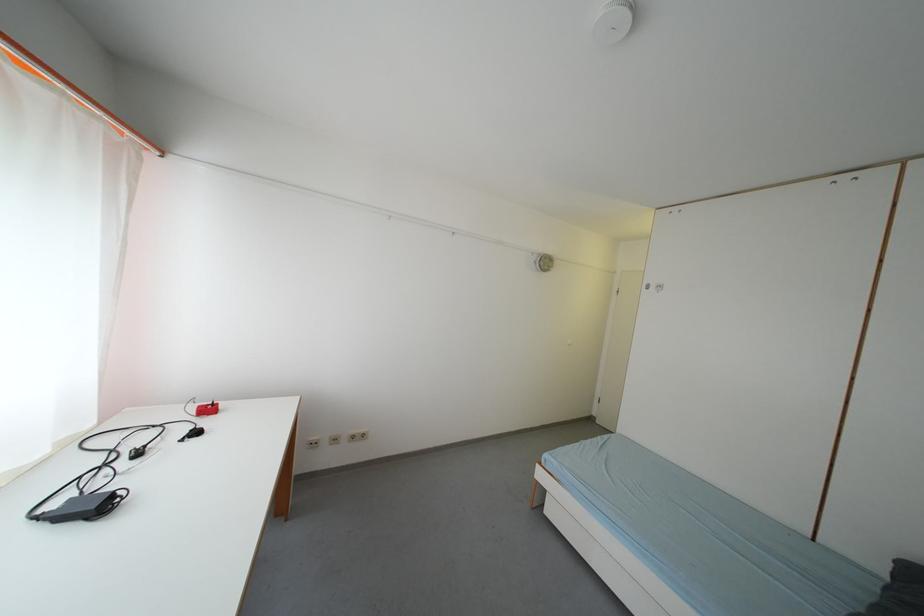
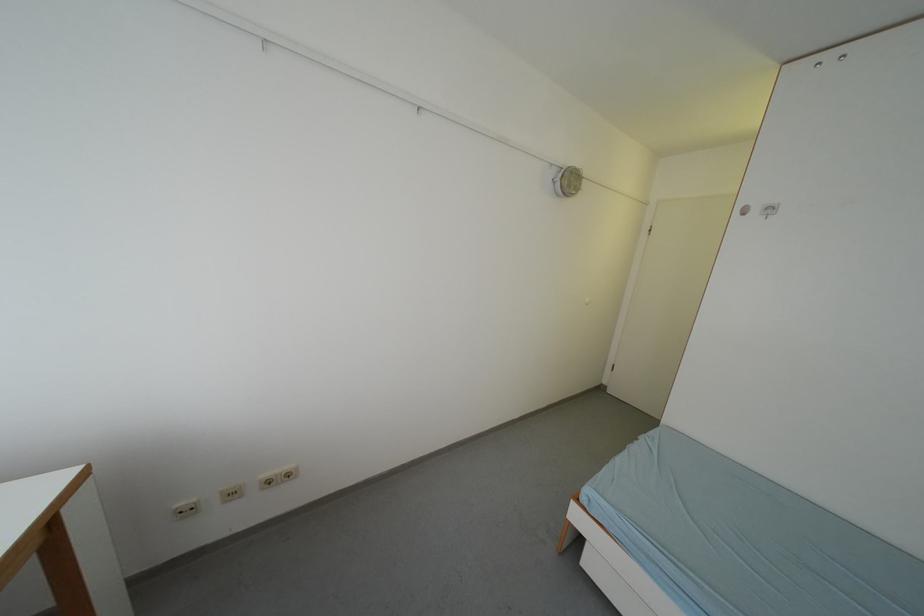
Question: The images are taken continuously from a first-person perspective. In which direction is your viewpoint rotating?

Choices:
 (A) Left
 (B) Right
 (C) Up
 (D) Down

Answer: (D)